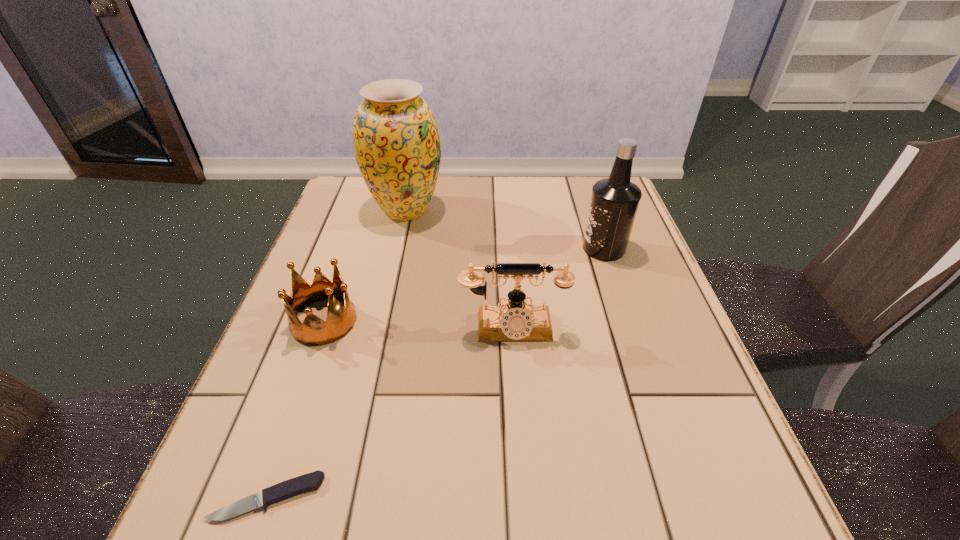
I want to click on the farthest object, so click(396, 141).

What are the coordinates of `the rightmost object` in the screenshot? It's located at (614, 202).

This screenshot has width=960, height=540. I want to click on the fourth nearest object, so click(614, 202).

The image size is (960, 540). Find the location of `telephone`. telephone is located at coordinates (515, 322).

Identify the location of the second object from right to left. (515, 322).

Where is `crown`? The height and width of the screenshot is (540, 960). crown is located at coordinates (314, 331).

Find the location of a particular element. steak knife is located at coordinates (311, 481).

Find the location of a particular element. Image resolution: width=960 pixels, height=540 pixels. the nearest object is located at coordinates (311, 481).

This screenshot has height=540, width=960. I want to click on vacant space located on the right of the farthest object, so click(573, 210).

Where is `vacant region located 0.170m on the front label of the second tallest object`? This screenshot has width=960, height=540. vacant region located 0.170m on the front label of the second tallest object is located at coordinates (514, 248).